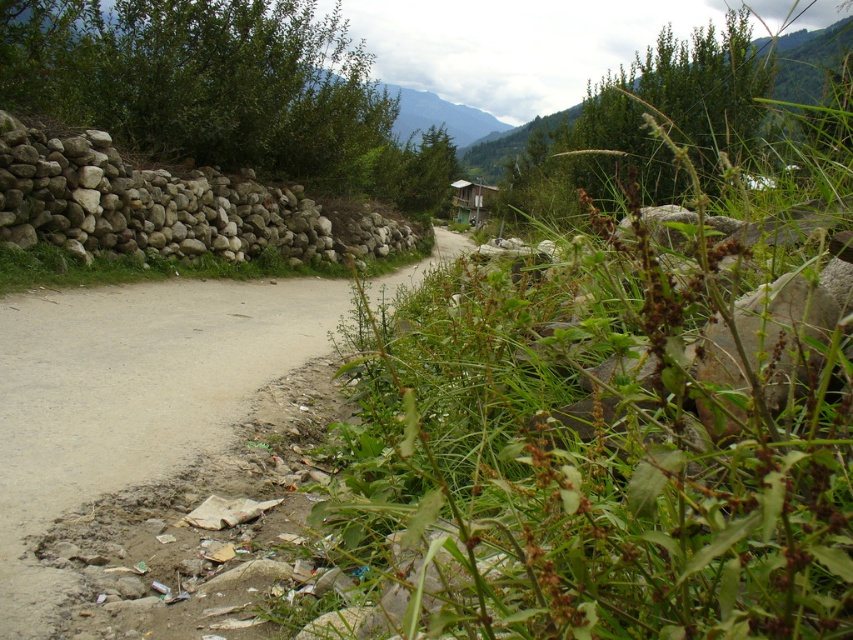
You are standing on the dirt road in the rural scene. You see two points marked on the road. One is at point (448, 125) and the other at point (453, 186). If you are facing the direction the road curves, which point is closer to you?

Point (453, 186) is closer to you because it is in front of point (448, 125) when facing the direction the road curves.

You are standing on the dirt road in the rural scene. You see the white rock wall at left and the wooden hut at center. Which object is closer to your right side?

The wooden hut at center is closer to your right side because the white rock wall at left is to the left of the wooden hut at center, meaning the hut is positioned further to the right relative to the wall.

You are standing at the point marked by coordinates point (x=129, y=396), which is on the brown dirt road at left. You want to walk to the stone wall on the left side of the road. Which direction should you move?

You should move to the left since the stone wall on the left side of the road is located to the left of the brown dirt road at left where you are standing.